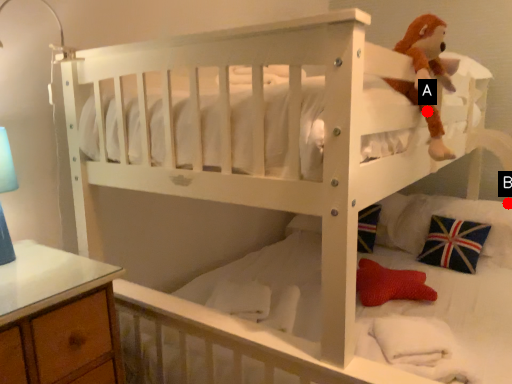
Question: Two points are circled on the image, labeled by A and B beside each circle. Which point is closer to the camera?

Choices:
 (A) A is closer
 (B) B is closer

Answer: (A)